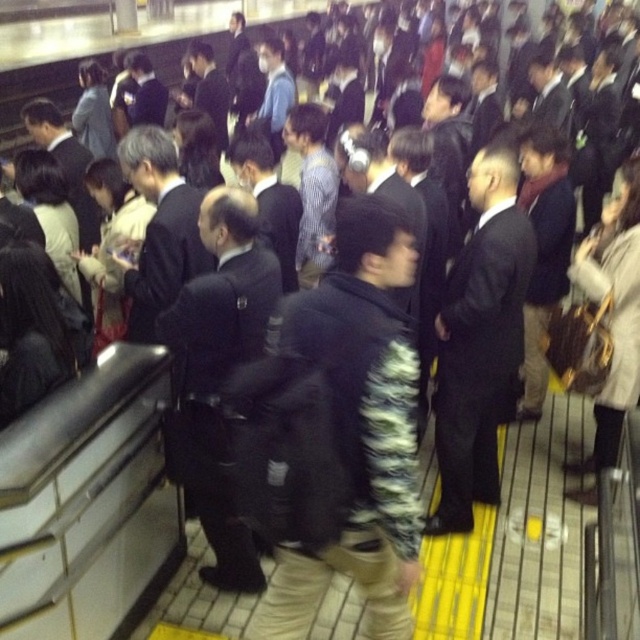
Question: Considering the relative positions of fluffy black jacket at center and dark blue uniform at center in the image provided, where is fluffy black jacket at center located with respect to dark blue uniform at center?

Choices:
 (A) above
 (B) below

Answer: (B)

Question: Considering the real-world distances, which object is closest to the fluffy black jacket at center?

Choices:
 (A) black suit at center
 (B) dark blue uniform at center

Answer: (B)

Question: Does fluffy black jacket at center have a lesser width compared to dark blue uniform at center?

Choices:
 (A) yes
 (B) no

Answer: (B)

Question: Which point is farther to the camera?

Choices:
 (A) (515, 369)
 (B) (330, 320)
 (C) (189, 300)

Answer: (A)

Question: Observing the image, what is the correct spatial positioning of black suit at center in reference to dark blue uniform at center?

Choices:
 (A) above
 (B) below

Answer: (A)

Question: Estimate the real-world distances between objects in this image. Which object is farther from the fluffy black jacket at center?

Choices:
 (A) black suit at center
 (B) dark blue uniform at center

Answer: (A)